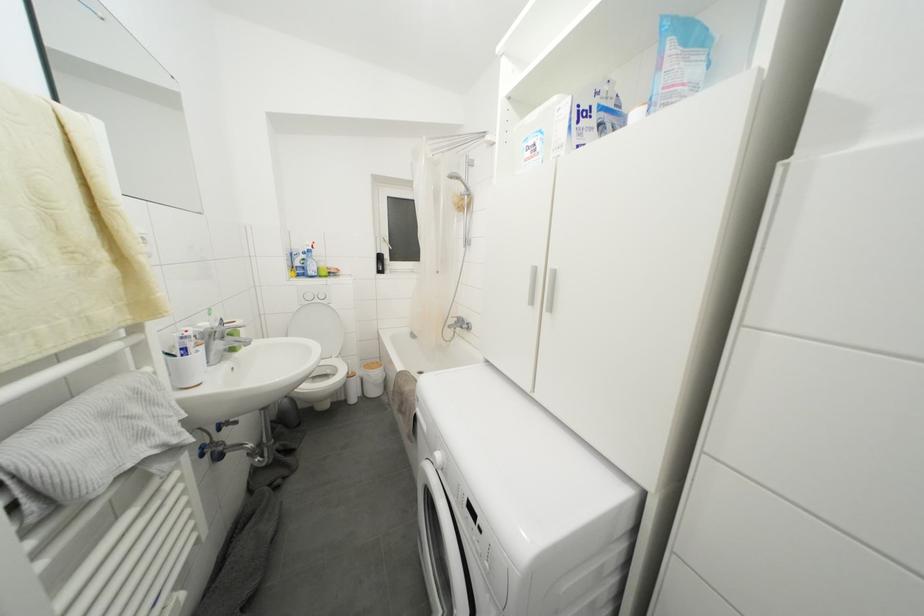
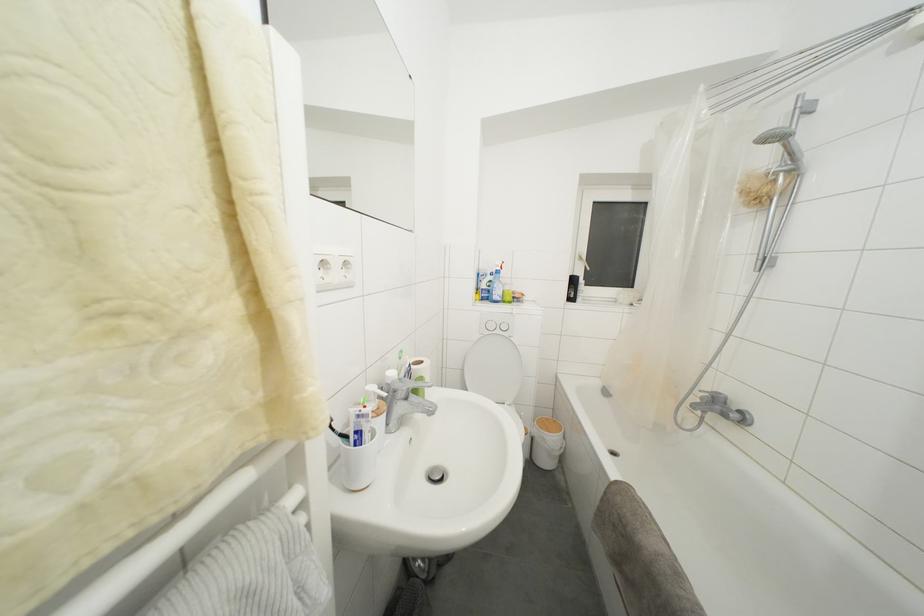
Locate, in the second image, the point that corresponds to (x=208, y=352) in the first image.

(388, 419)